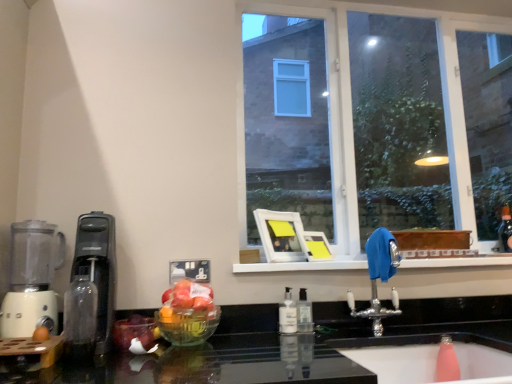
Measure the distance between point [258,377] and camera.

The distance of point [258,377] from camera is 4.65 feet.

What do you see at coordinates (187, 325) in the screenshot? I see `transparent glass bowl at center` at bounding box center [187, 325].

This screenshot has width=512, height=384. I want to click on transparent glass bottle at left, the first bottle in the front-to-back sequence, so click(81, 315).

What do you see at coordinates (98, 269) in the screenshot?
I see `black plastic coffee machine at left` at bounding box center [98, 269].

What is the approximate width of silver metallic faucet at center?

silver metallic faucet at center is 9.99 inches in width.

Image resolution: width=512 pixels, height=384 pixels. Describe the element at coordinates (394, 356) in the screenshot. I see `pink rubber sink at lower right` at that location.

At what (x,y) coordinates should I click in order to perform the action: click on clear glass window at upper center. Please return your answer as a coordinate pair (x, y). Looking at the image, I should click on (351, 108).

Identify the location of black glossy countertop at lower center. (227, 355).

Which object is closer to the camera, silver metallic faucet at center or transparent glass bottle at left, the third bottle from the right?

Positioned in front is transparent glass bottle at left, the third bottle from the right.

Would you say silver metallic faucet at center contains transparent glass bottle at left, the 3th bottle when ordered from back to front?

No, transparent glass bottle at left, the 3th bottle when ordered from back to front, is located outside of silver metallic faucet at center.

Which of these two, silver metallic faucet at center or transparent glass bottle at left, placed as the 1th bottle when sorted from left to right, is smaller?

With smaller size is transparent glass bottle at left, placed as the 1th bottle when sorted from left to right.

Are clear plastic soap dispenser at center, which is the second bottle from left to right, and clear plastic soap dispenser at center, acting as the third bottle starting from the front, beside each other?

Yes, clear plastic soap dispenser at center, which is the second bottle from left to right, is touching clear plastic soap dispenser at center, acting as the third bottle starting from the front.

Is clear plastic soap dispenser at center, marked as the second bottle in a front-to-back arrangement, located outside clear plastic soap dispenser at center, the 1th bottle in the back-to-front sequence?

Yes, clear plastic soap dispenser at center, marked as the second bottle in a front-to-back arrangement, is located beyond the bounds of clear plastic soap dispenser at center, the 1th bottle in the back-to-front sequence.

Considering the relative positions of clear plastic soap dispenser at center, which is the second bottle from back to front, and clear plastic soap dispenser at center, marked as the first bottle in a right-to-left arrangement, in the image provided, is clear plastic soap dispenser at center, which is the second bottle from back to front, to the left of clear plastic soap dispenser at center, marked as the first bottle in a right-to-left arrangement, from the viewer's perspective?

Yes, clear plastic soap dispenser at center, which is the second bottle from back to front, is to the left of clear plastic soap dispenser at center, marked as the first bottle in a right-to-left arrangement.

Are clear plastic soap dispenser at center, acting as the third bottle starting from the front, and transparent glass bowl at center far apart?

No, clear plastic soap dispenser at center, acting as the third bottle starting from the front, is in close proximity to transparent glass bowl at center.

Which is more to the left, clear plastic soap dispenser at center, placed as the 3th bottle when sorted from left to right, or transparent glass bowl at center?

transparent glass bowl at center is more to the left.

From the image's perspective, which object appears higher, clear plastic soap dispenser at center, acting as the third bottle starting from the front, or transparent glass bowl at center?

transparent glass bowl at center, from the image's perspective.

Is point (304, 308) behind point (174, 337)?

Yes, it is.

Considering the sizes of black plastic coffee machine at left and clear plastic soap dispenser at center, which is the second bottle from left to right, in the image, is black plastic coffee machine at left wider or thinner than clear plastic soap dispenser at center, which is the second bottle from left to right,?

Clearly, black plastic coffee machine at left has more width compared to clear plastic soap dispenser at center, which is the second bottle from left to right.

From the image's perspective, starting from the black plastic coffee machine at left, which bottle is the 2nd one below? Please provide its 2D coordinates.

[(287, 314)]

Between black plastic coffee machine at left and clear plastic soap dispenser at center, placed as the second bottle when sorted from right to left, which one is positioned in front?

Positioned in front is black plastic coffee machine at left.

Considering the positions of objects black plastic coffee machine at left and clear plastic soap dispenser at center, placed as the second bottle when sorted from right to left, in the image provided, who is more to the left, black plastic coffee machine at left or clear plastic soap dispenser at center, placed as the second bottle when sorted from right to left,?

black plastic coffee machine at left is more to the left.

From the image's perspective, which object appears higher, black glossy countertop at lower center or pink rubber sink at lower right?

black glossy countertop at lower center is shown above in the image.

From the picture: Which is in front, black glossy countertop at lower center or pink rubber sink at lower right?

black glossy countertop at lower center.

Considering the positions of objects black glossy countertop at lower center and pink rubber sink at lower right in the image provided, who is more to the right, black glossy countertop at lower center or pink rubber sink at lower right?

From the viewer's perspective, pink rubber sink at lower right appears more on the right side.

Is there a large distance between black glossy countertop at lower center and pink rubber sink at lower right?

No, black glossy countertop at lower center is in close proximity to pink rubber sink at lower right.

The width and height of the screenshot is (512, 384). Identify the location of glass bowl behind the transparent glass bottle at left, placed as the 1th bottle when sorted from left to right. (187, 325).

Is transparent glass bottle at left, the first bottle in the front-to-back sequence, with transparent glass bowl at center?

No, transparent glass bottle at left, the first bottle in the front-to-back sequence, is not in contact with transparent glass bowl at center.

Does transparent glass bottle at left, the first bottle in the front-to-back sequence, appear on the right side of transparent glass bowl at center?

In fact, transparent glass bottle at left, the first bottle in the front-to-back sequence, is to the left of transparent glass bowl at center.

How different are the orientations of transparent glass bottle at left, the 3th bottle when ordered from back to front, and transparent glass bowl at center in degrees?

The angle between the facing direction of transparent glass bottle at left, the 3th bottle when ordered from back to front, and the facing direction of transparent glass bowl at center is 1.18 degrees.

Is point (377, 273) closer to viewer compared to point (51, 244)?

No, it is behind (51, 244).

Between silver metallic faucet at center and white plastic blender at left, which one is positioned behind?

silver metallic faucet at center is behind.

Is silver metallic faucet at center aimed at white plastic blender at left?

No, silver metallic faucet at center is not turned towards white plastic blender at left.

How distant is silver metallic faucet at center from white plastic blender at left?

A distance of 3.61 feet exists between silver metallic faucet at center and white plastic blender at left.

The image size is (512, 384). Identify the location of tap on the right of transparent glass bottle at left, the first bottle in the front-to-back sequence. (379, 277).

From the clear plastic soap dispenser at center, acting as the third bottle starting from the front, count the 1st bottle to the left and point to it. Please provide its 2D coordinates.

[(287, 314)]

Based on their spatial positions, is silver metallic faucet at center or pink rubber sink at lower right closer to shiny red apple at lower left?

silver metallic faucet at center is positioned closer to the anchor shiny red apple at lower left.

Estimate the real-world distances between objects in this image. Which object is further from clear plastic soap dispenser at center, placed as the 3th bottle when sorted from left to right, silver metallic faucet at center or black glossy countertop at lower center?

black glossy countertop at lower center.

Estimate the real-world distances between objects in this image. Which object is closer to silver metallic faucet at center, clear plastic soap dispenser at center, placed as the 3th bottle when sorted from left to right, or clear plastic soap dispenser at center, marked as the second bottle in a front-to-back arrangement?

clear plastic soap dispenser at center, placed as the 3th bottle when sorted from left to right, is closer to silver metallic faucet at center.

Estimate the real-world distances between objects in this image. Which object is closer to black glossy countertop at lower center, pink rubber sink at lower right or black plastic coffee machine at left?

pink rubber sink at lower right lies closer to black glossy countertop at lower center than the other object.

Considering their positions, is clear glass window at upper center positioned further to silver metallic faucet at center than white matte window sill at center?

clear glass window at upper center.

Looking at the image, which one is located further to black glossy countertop at lower center, white matte window sill at center or silver metallic faucet at center?

Based on the image, white matte window sill at center appears to be further to black glossy countertop at lower center.

Estimate the real-world distances between objects in this image. Which object is closer to clear glass window at upper center, white plastic blender at left or clear plastic soap dispenser at center, which is the second bottle from left to right?

clear plastic soap dispenser at center, which is the second bottle from left to right.

From the image, which object appears to be farther from clear plastic soap dispenser at center, which is the second bottle from left to right, pink rubber sink at lower right or black plastic coffee machine at left?

black plastic coffee machine at left is positioned further to the anchor clear plastic soap dispenser at center, which is the second bottle from left to right.

Where is `apple situated between white plastic blender at left and pink rubber sink at lower right from left to right`? This screenshot has width=512, height=384. apple situated between white plastic blender at left and pink rubber sink at lower right from left to right is located at coordinates (135, 333).

Where is `tap between pink rubber sink at lower right and white matte window sill at center along the z-axis`? tap between pink rubber sink at lower right and white matte window sill at center along the z-axis is located at coordinates (379, 277).

You are a GUI agent. You are given a task and a screenshot of the screen. Output one action in this format:
    pyautogui.click(x=<x>, y=<y>)
    Task: Click on the bottle between white plastic blender at left and shiny red apple at lower left in the horizontal direction
    Image resolution: width=512 pixels, height=384 pixels.
    Given the screenshot: What is the action you would take?
    pyautogui.click(x=81, y=315)

Where is `coffee machine situated between white plastic blender at left and transparent glass bottle at left, the 3th bottle when ordered from back to front, from left to right`? coffee machine situated between white plastic blender at left and transparent glass bottle at left, the 3th bottle when ordered from back to front, from left to right is located at coordinates (98, 269).